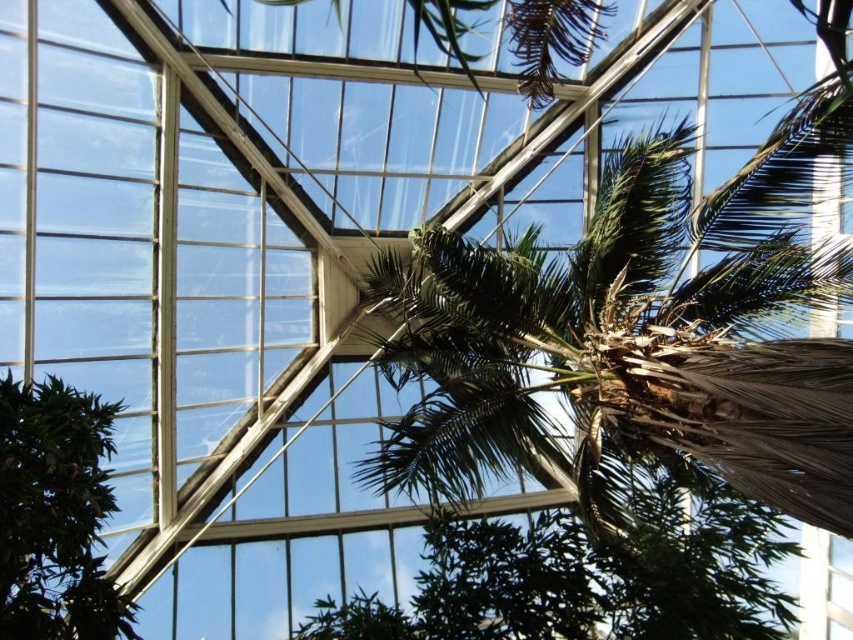
Question: Which of the following is the closest to the observer?

Choices:
 (A) green leafy tree at lower left
 (B) green leafy palm tree at center

Answer: (B)

Question: Which point appears farthest from the camera in this image?

Choices:
 (A) (48, 445)
 (B) (671, 468)

Answer: (B)

Question: In this image, where is green leafy palm tree at center located relative to green leafy tree at lower left?

Choices:
 (A) right
 (B) left

Answer: (A)

Question: Which point is closer to the camera taking this photo?

Choices:
 (A) (374, 476)
 (B) (18, 454)

Answer: (B)

Question: Does green leafy palm tree at center have a larger size compared to green leafy tree at lower left?

Choices:
 (A) yes
 (B) no

Answer: (A)

Question: Is green leafy palm tree at center further to the viewer compared to green leafy tree at lower left?

Choices:
 (A) yes
 (B) no

Answer: (B)